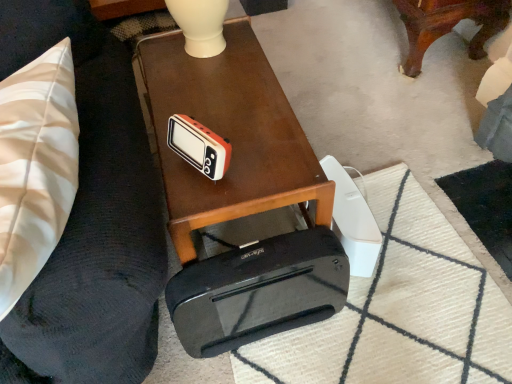
Locate an element on the screen. This screenshot has height=384, width=512. free space in front of black plastic cassette at lower center is located at coordinates pyautogui.click(x=274, y=362).